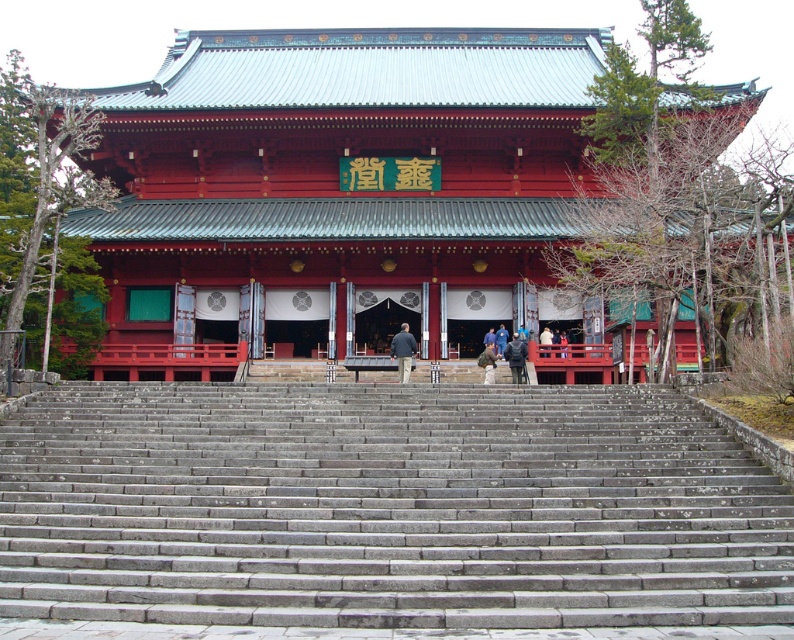
Question: Can you confirm if gray stone stairs at center is positioned to the left of dark gray fabric jacket at center?

Choices:
 (A) yes
 (B) no

Answer: (A)

Question: Which of these objects is positioned farthest from the dark gray stone person at center?

Choices:
 (A) shiny red wood temple at center
 (B) light brown leather jacket at center

Answer: (A)

Question: Is shiny red wood temple at center above dark gray jacket at center?

Choices:
 (A) no
 (B) yes

Answer: (B)

Question: Which object is positioned closest to the dark gray stone person at center?

Choices:
 (A) gray stone stairs at center
 (B) dark gray fabric jacket at center

Answer: (B)

Question: Can you confirm if dark gray jacket at center is positioned above light brown leather jacket at center?

Choices:
 (A) no
 (B) yes

Answer: (A)

Question: Among these points, which one is farthest from the camera?

Choices:
 (A) (430, 458)
 (B) (548, 342)

Answer: (B)